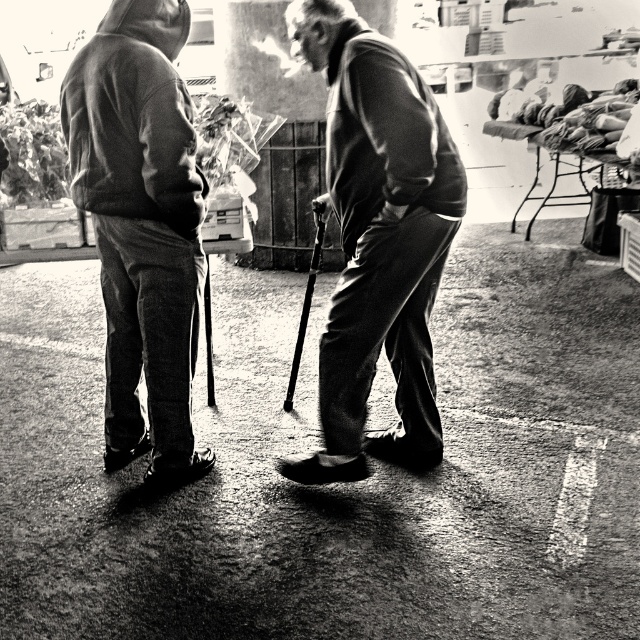
You are a photographer trying to capture a closeup of the two people in the image. You notice there are two metallic objects at the center of the image. Which one is more likely to reflect the camera flash, the smooth metal cane at center or the metallic silver ski pole at center?

The smooth metal cane at center is wider than the metallic silver ski pole at center, so it has a larger surface area to reflect the camera flash more effectively.

You are a photographer trying to capture the scene. You notice the smooth fabric jacket at center and the dark gray hoodie at left. Which object is positioned lower in the image?

The smooth fabric jacket at center is positioned lower than the dark gray hoodie at left in the image.